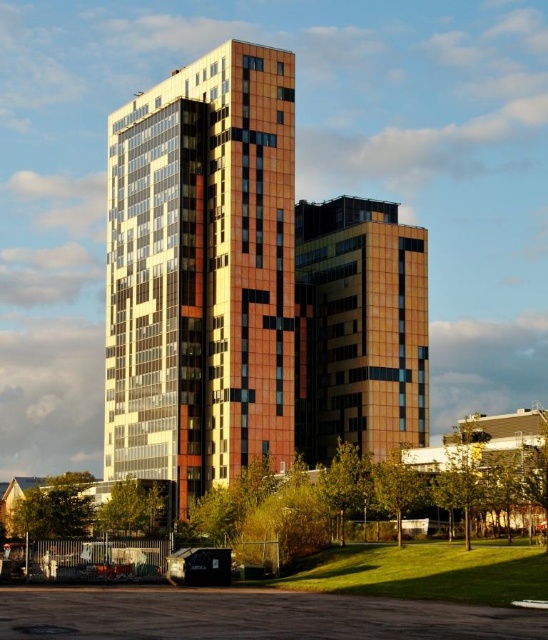
Question: Which of the following is the farthest from the observer?

Choices:
 (A) multicolored mosaic building at center
 (B) orange glass building at center

Answer: (B)

Question: Is multicolored mosaic building at center positioned at the back of orange glass building at center?

Choices:
 (A) no
 (B) yes

Answer: (A)

Question: Does multicolored mosaic building at center appear on the left side of orange glass building at center?

Choices:
 (A) yes
 (B) no

Answer: (A)

Question: Among these objects, which one is farthest from the camera?

Choices:
 (A) orange glass building at center
 (B) multicolored mosaic building at center

Answer: (A)

Question: Does multicolored mosaic building at center appear over orange glass building at center?

Choices:
 (A) yes
 (B) no

Answer: (A)